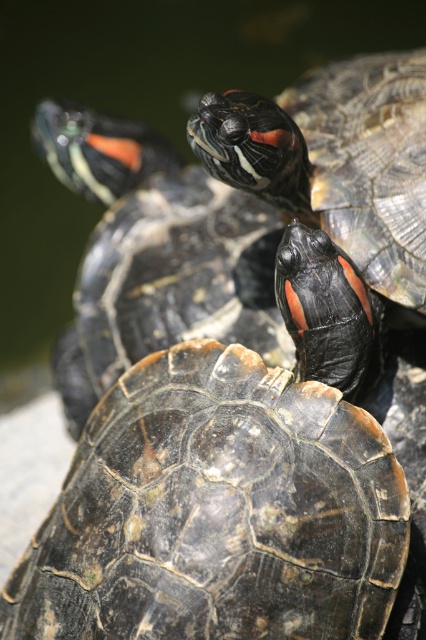
Is the position of shiny dark tortoise at center less distant than that of shiny black turtle at upper right?

Yes, shiny dark tortoise at center is in front of shiny black turtle at upper right.

What are the coordinates of `shiny dark tortoise at center` in the screenshot? It's located at (230, 488).